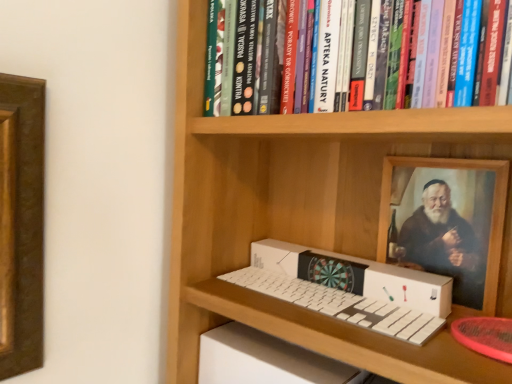
Question: From a real-world perspective, does hardcover book at upper center sit lower than white cardboard box at center?

Choices:
 (A) no
 (B) yes

Answer: (A)

Question: Does hardcover book at upper center touch white cardboard box at center?

Choices:
 (A) yes
 (B) no

Answer: (B)

Question: Can you confirm if hardcover book at upper center is taller than white cardboard box at center?

Choices:
 (A) yes
 (B) no

Answer: (A)

Question: Is hardcover book at upper center smaller than white cardboard box at center?

Choices:
 (A) no
 (B) yes

Answer: (A)

Question: Is there a large distance between hardcover book at upper center and white cardboard box at center?

Choices:
 (A) yes
 (B) no

Answer: (B)

Question: Is the depth of hardcover book at upper center greater than that of white cardboard box at center?

Choices:
 (A) yes
 (B) no

Answer: (B)

Question: Is white cardboard box at center bigger than hardcover book at upper center?

Choices:
 (A) no
 (B) yes

Answer: (A)

Question: Is white cardboard box at center placed right next to hardcover book at upper center?

Choices:
 (A) yes
 (B) no

Answer: (B)

Question: From the image's perspective, would you say white cardboard box at center is positioned over hardcover book at upper center?

Choices:
 (A) no
 (B) yes

Answer: (A)

Question: Can you confirm if white cardboard box at center is thinner than hardcover book at upper center?

Choices:
 (A) yes
 (B) no

Answer: (A)

Question: Is white cardboard box at center not near hardcover book at upper center?

Choices:
 (A) no
 (B) yes

Answer: (A)

Question: Can you confirm if white cardboard box at center is shorter than hardcover book at upper center?

Choices:
 (A) no
 (B) yes

Answer: (B)

Question: Is point (435, 14) positioned closer to the camera than point (268, 268)?

Choices:
 (A) farther
 (B) closer

Answer: (B)